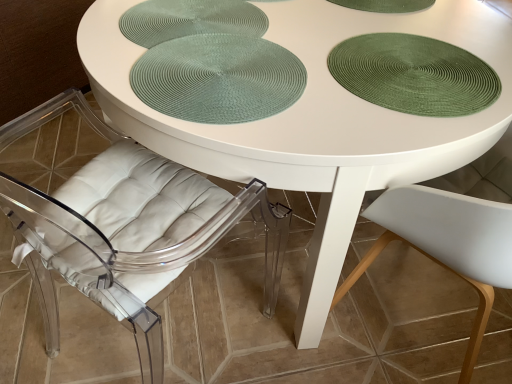
In order to click on free region on the left part of green textured placemat at upper right, positioned as the 2th glass plate in left-to-right order in this screenshot , I will do `click(264, 70)`.